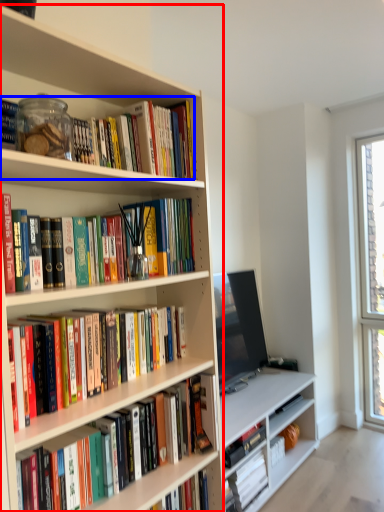
Question: Which point is closer to the camera, bookcase (highlighted by a red box) or book (highlighted by a blue box)?

Choices:
 (A) bookcase
 (B) book

Answer: (A)